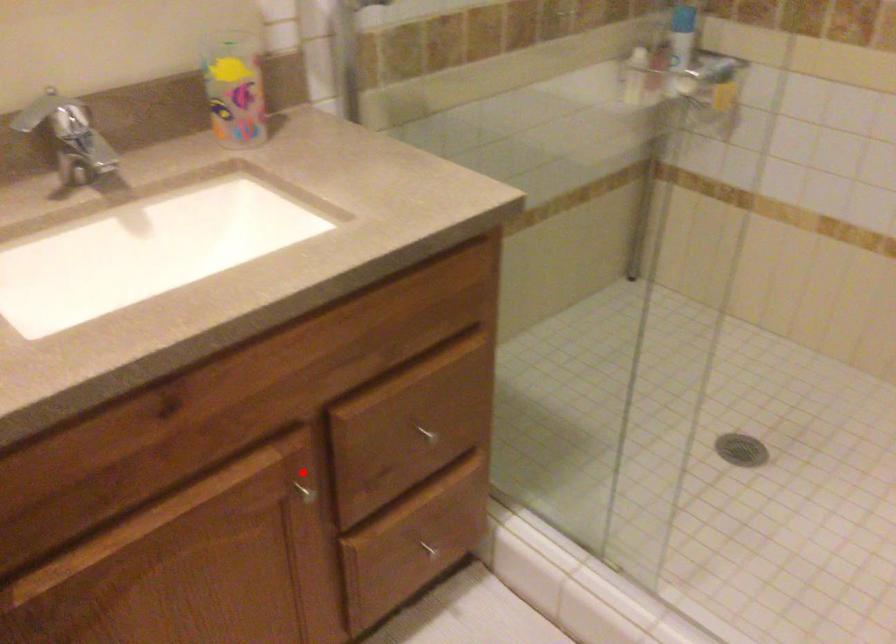
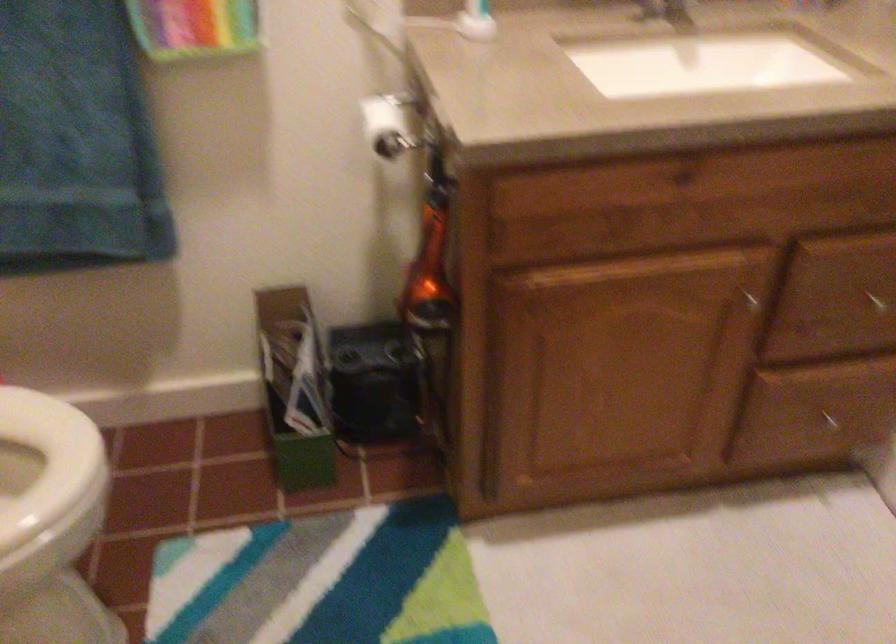
Where in the second image is the point corresponding to the highlighted location from the first image?

(752, 285)